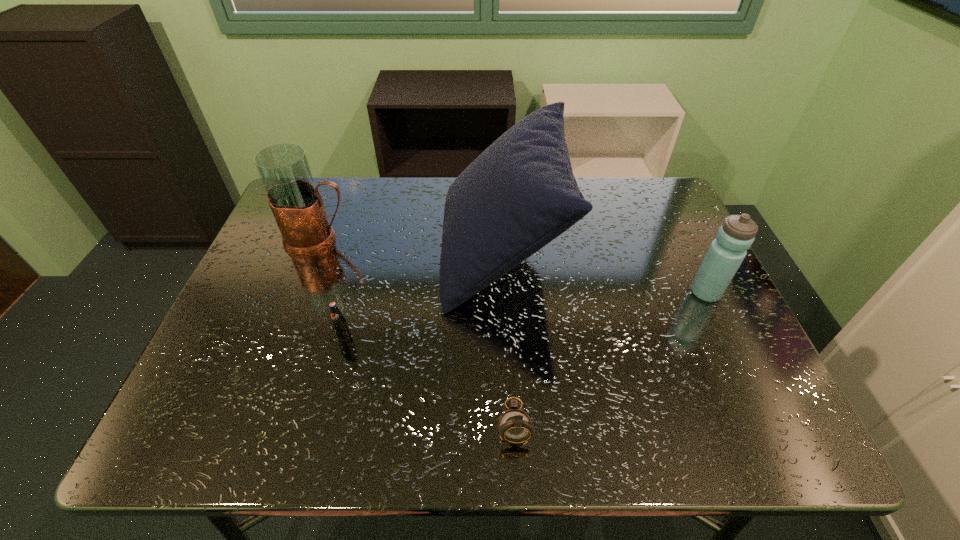
The image size is (960, 540). What are the coordinates of `empty space between the pitcher and the shortest object` in the screenshot? It's located at (x=417, y=331).

Where is `vacant area that lies between the rightmost object and the second nearest object`? Image resolution: width=960 pixels, height=540 pixels. vacant area that lies between the rightmost object and the second nearest object is located at coordinates (525, 315).

Locate an element on the screen. Image resolution: width=960 pixels, height=540 pixels. object that is the closest to the second shortest object is located at coordinates (518, 195).

Where is `object that ranks as the fourth closest to the pitcher`? The image size is (960, 540). object that ranks as the fourth closest to the pitcher is located at coordinates (735, 236).

Identify the location of free space that satisfies the following two spatial constraints: 1. on the facing side of the cushion; 2. on the front label of the fourth object from right to left. (506, 339).

Locate an element on the screen. The image size is (960, 540). vacant area that satisfies the following two spatial constraints: 1. with the handle on the side of the leftmost object; 2. on the right side of the water bottle is located at coordinates (298, 293).

What are the coordinates of `free space that satisfies the following two spatial constraints: 1. on the facing side of the rightmost object; 2. on the left side of the cushion` in the screenshot? It's located at (504, 293).